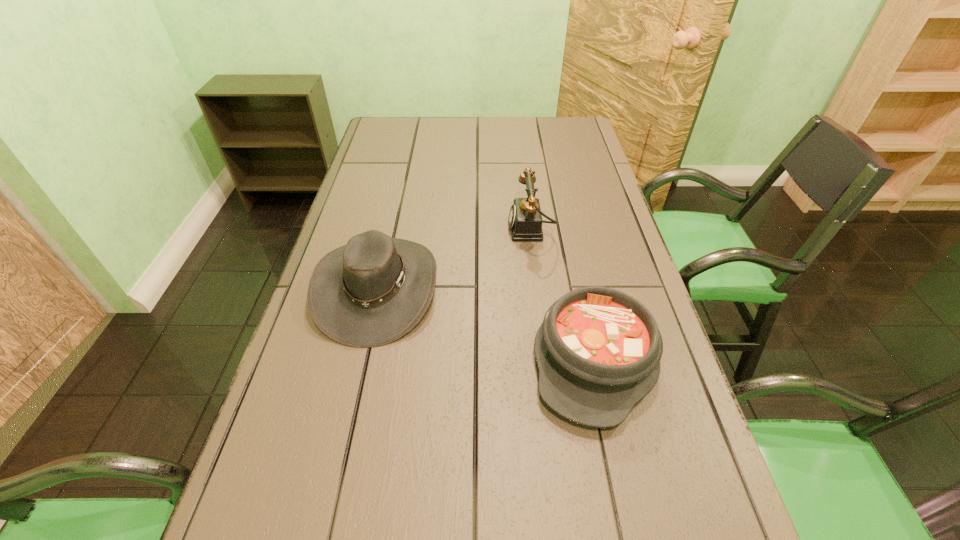
Where is `the farthest object`? the farthest object is located at coordinates (480, 52).

The image size is (960, 540). What are the coordinates of `shopping bag` in the screenshot? It's located at (391, 171).

The image size is (960, 540). In order to click on the farthest detergent in this screenshot , I will do `click(514, 150)`.

You are a GUI agent. You are given a task and a screenshot of the screen. Output one action in this format:
    pyautogui.click(x=<x>, y=<y>)
    Task: Click on the farthest white detergent
    The height and width of the screenshot is (540, 960).
    Given the screenshot: What is the action you would take?
    pyautogui.click(x=514, y=150)

Where is `the left red detergent`? This screenshot has width=960, height=540. the left red detergent is located at coordinates (275, 375).

Identify the location of the leftmost detergent. (275, 375).

Find the location of `the second nearest white detergent`. the second nearest white detergent is located at coordinates (618, 302).

What are the coordinates of `the second smallest white detergent` in the screenshot? It's located at (618, 302).

Locate an element on the screen. The height and width of the screenshot is (540, 960). the smaller red detergent is located at coordinates (480, 326).

Find the location of `vacant point located 0.290m on the front of the farthest object`. vacant point located 0.290m on the front of the farthest object is located at coordinates (515, 181).